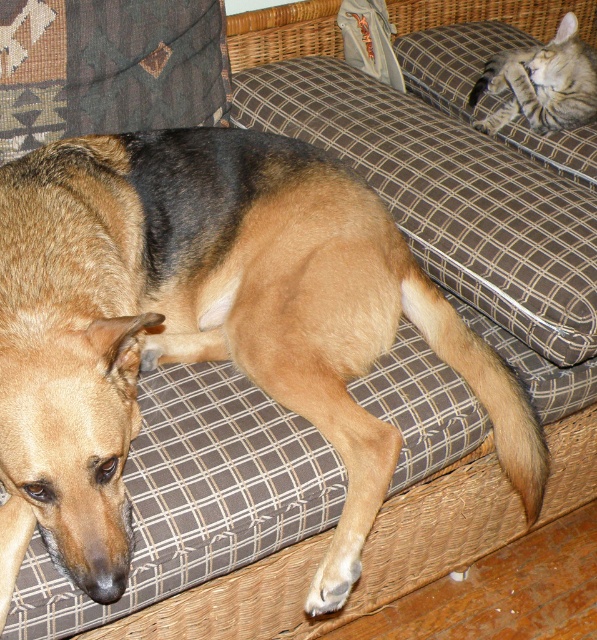
Question: Which point is closer to the camera?

Choices:
 (A) golden-brown fur dog at center
 (B) striped fur cat at upper right

Answer: (A)

Question: Does golden-brown fur dog at center appear over striped fur cat at upper right?

Choices:
 (A) no
 (B) yes

Answer: (A)

Question: Does golden-brown fur dog at center have a greater width compared to striped fur cat at upper right?

Choices:
 (A) no
 (B) yes

Answer: (B)

Question: Is golden-brown fur dog at center to the right of striped fur cat at upper right from the viewer's perspective?

Choices:
 (A) yes
 (B) no

Answer: (B)